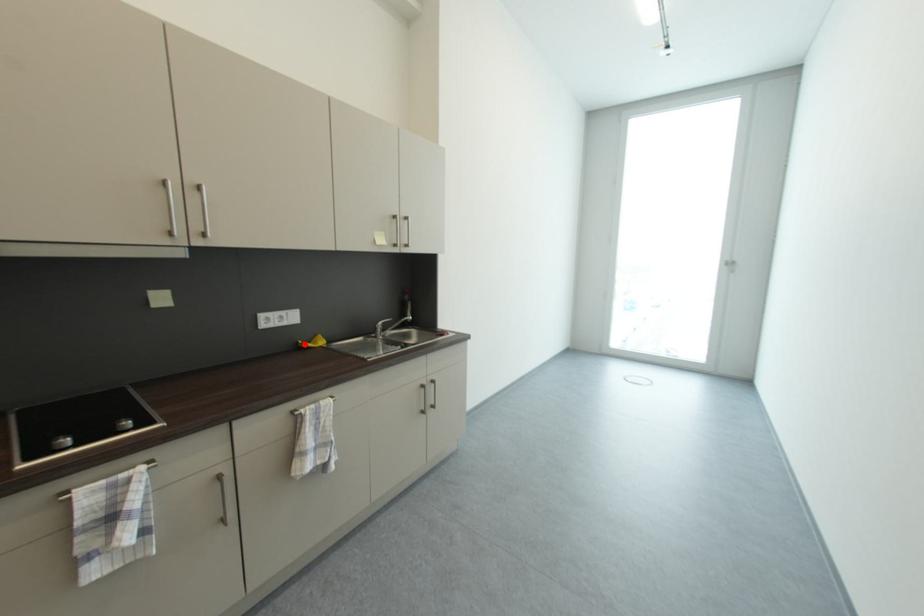
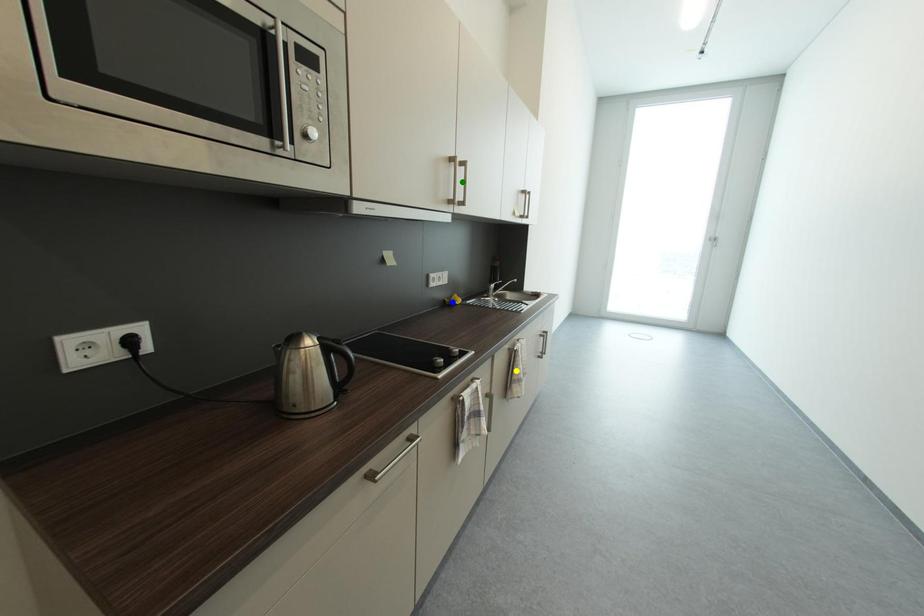
Question: I am providing you with two images of the same scene from different viewpoints. A red point is marked on the first image. You are given multiple points on the second image. Which spot in image 2 lines up with the point in image 1?

Choices:
 (A) green point
 (B) yellow point
 (C) blue point

Answer: (C)